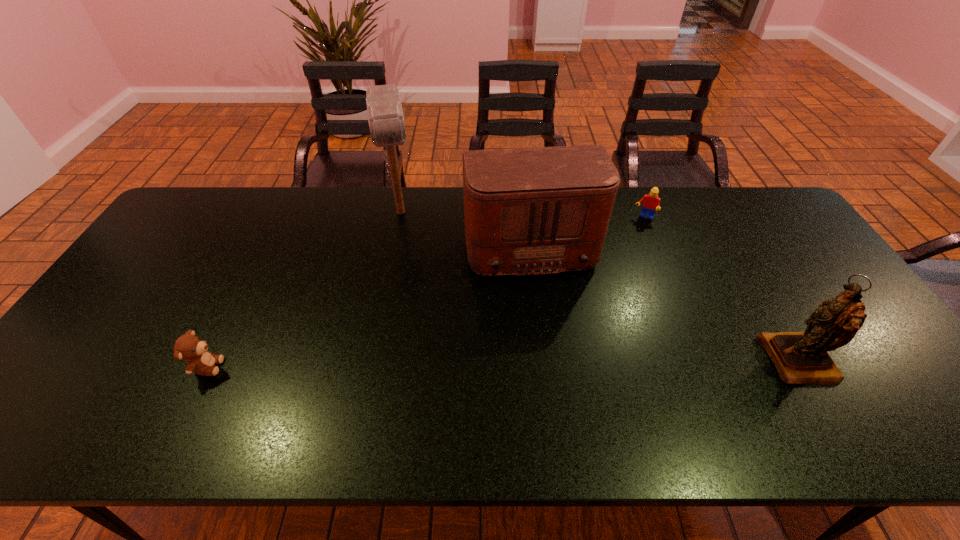
The width and height of the screenshot is (960, 540). I want to click on vacant region at the far right corner, so [x=784, y=214].

In order to click on free space between the leftmost object and the tallest object in this screenshot , I will do `click(304, 289)`.

Locate an element on the screen. The height and width of the screenshot is (540, 960). vacant area that lies between the second object from right to left and the teddy bear is located at coordinates (425, 292).

Locate an element on the screen. empty location between the figurine and the second object from right to left is located at coordinates pos(721,289).

Locate an element on the screen. Image resolution: width=960 pixels, height=540 pixels. vacant region between the radio receiver and the leftmost object is located at coordinates (368, 306).

You are a GUI agent. You are given a task and a screenshot of the screen. Output one action in this format:
    pyautogui.click(x=<x>, y=<y>)
    Task: Click on the empty location between the radio receiver and the rightmost object
    
    Given the screenshot: What is the action you would take?
    pyautogui.click(x=663, y=303)

Locate an element on the screen. free space between the teddy bear and the radio receiver is located at coordinates (368, 306).

Find the location of a particular element. vacant area between the rightmost object and the third object from left to right is located at coordinates (663, 303).

Locate an element on the screen. free space that is in between the fourth object from right to left and the teddy bear is located at coordinates (304, 289).

You are a GUI agent. You are given a task and a screenshot of the screen. Output one action in this format:
    pyautogui.click(x=<x>, y=<y>)
    Task: Click on the blank region between the third object from right to left and the teddy bear
    The width and height of the screenshot is (960, 540).
    Given the screenshot: What is the action you would take?
    pyautogui.click(x=368, y=306)